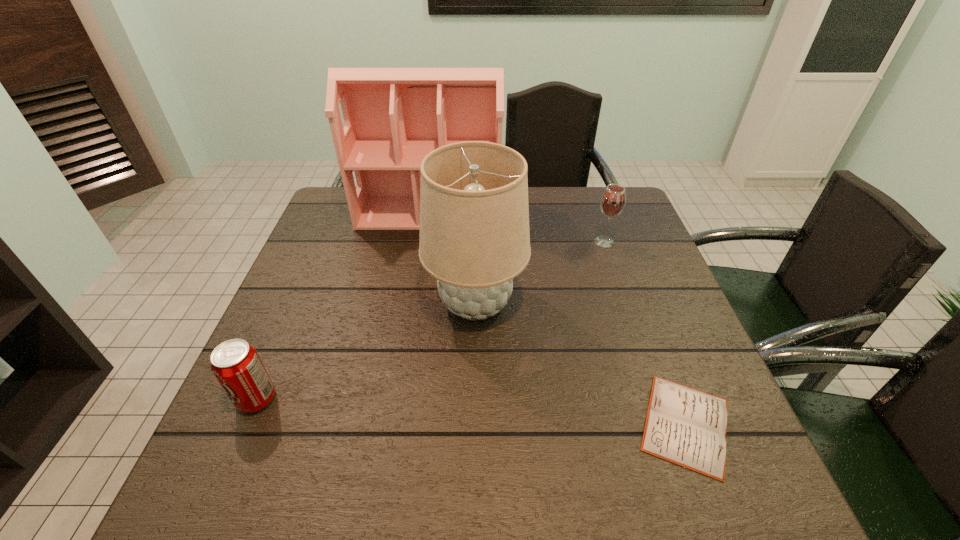
Identify the location of vacant space that satisfies the following two spatial constraints: 1. on the front side of the shortest object; 2. on the right side of the wineglass. Image resolution: width=960 pixels, height=540 pixels. (666, 424).